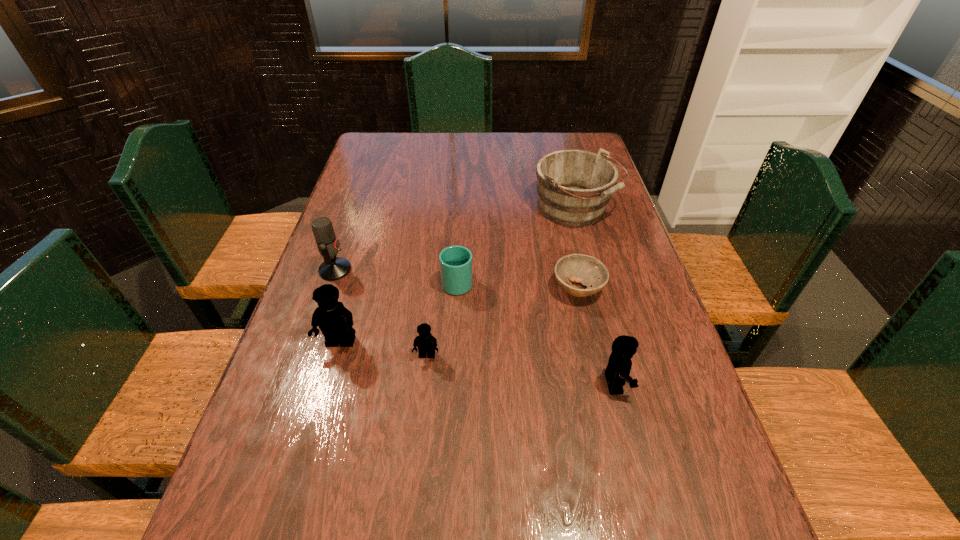
Find the location of a particular element. the leftmost Lego is located at coordinates (335, 321).

Where is `the shortest Lego`? This screenshot has height=540, width=960. the shortest Lego is located at coordinates (427, 343).

Where is `the nearest Lego`? the nearest Lego is located at coordinates (618, 369).

Find the location of `the nearest object`. the nearest object is located at coordinates (618, 369).

The height and width of the screenshot is (540, 960). In order to click on microphone in this screenshot , I will do `click(333, 268)`.

Locate an element on the screen. The width and height of the screenshot is (960, 540). wine bucket is located at coordinates (574, 187).

Locate an element on the screen. The image size is (960, 540). cup is located at coordinates (455, 262).

The height and width of the screenshot is (540, 960). In order to click on bowl in this screenshot , I will do `click(587, 270)`.

This screenshot has height=540, width=960. What are the coordinates of `vacant space located 0.170m on the front-facing side of the leftmost Lego` in the screenshot? It's located at (318, 423).

Locate an element on the screen. The width and height of the screenshot is (960, 540). vacant space located 0.190m on the front-facing side of the shortest Lego is located at coordinates (418, 443).